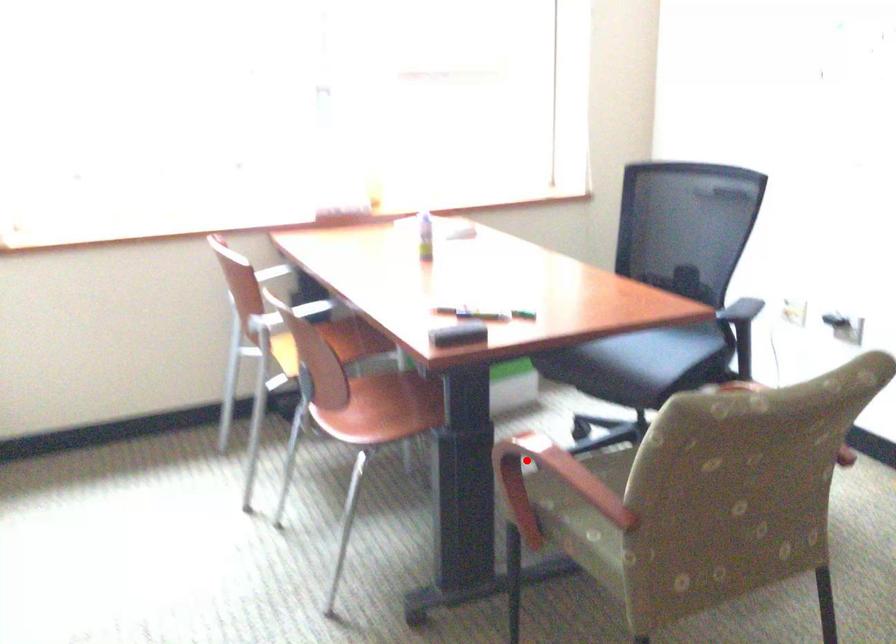
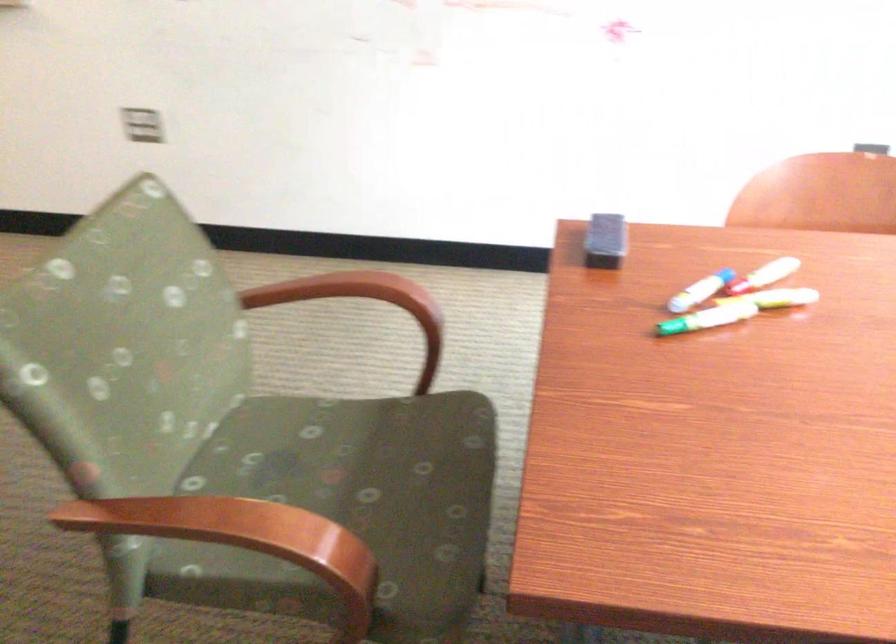
Question: I am providing you with two images of the same scene from different viewpoints. In image1, a red point is highlighted. Considering the same 3D point in image2, which of the following is correct?

Choices:
 (A) It is closer
 (B) It is farther

Answer: (A)